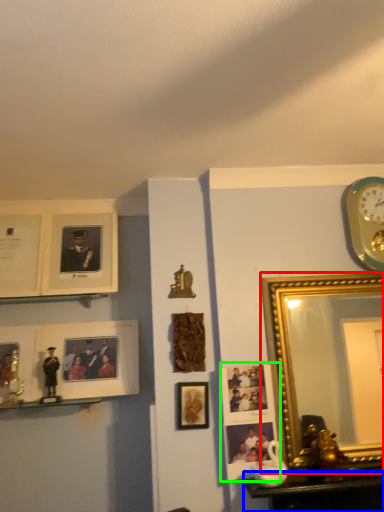
Question: Which object is positioned closest to picture frame (highlighted by a red box)? Select from table (highlighted by a blue box) and picture frame (highlighted by a green box).

Choices:
 (A) table
 (B) picture frame

Answer: (B)